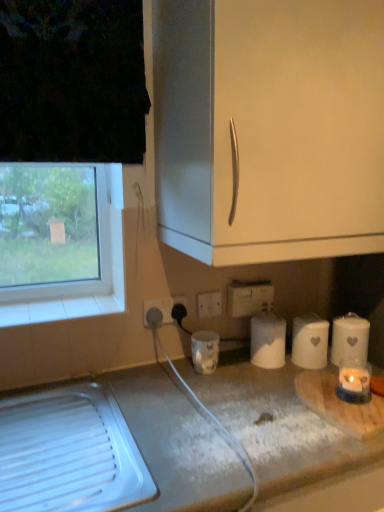
This screenshot has height=512, width=384. What are the coordinates of `vacant space situated on the left part of white ceramic candle at lower center` in the screenshot? It's located at pyautogui.click(x=172, y=371).